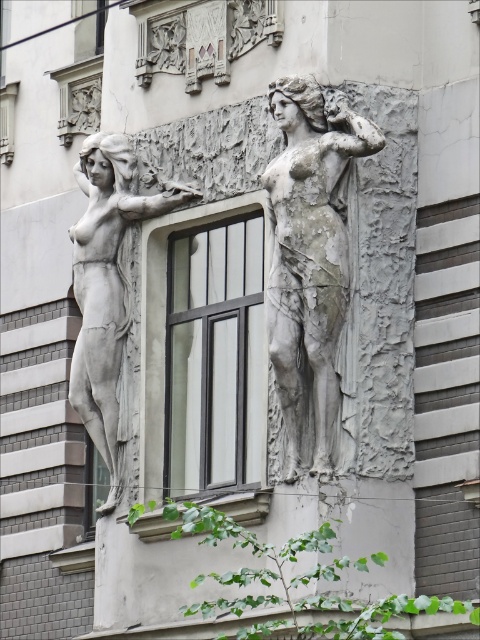
Based on the photo, you are an architect inspecting the facade of a building. You notice the black glass window at center and the stone statue at center. According to the scene, which one is positioned to the left?

The black glass window at center is to the left of the stone statue at center, so the black glass window at center is positioned to the left.

You are an architect assessing the building facade. The stone statue at center and the matte gray statue at left are both part of the design. Which statue is shorter?

The stone statue at center is shorter than the matte gray statue at left.